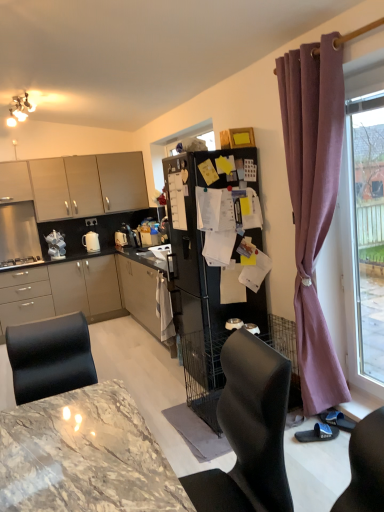
Question: Does matte white cabinet at upper left, the second cabinetry from the top, lie in front of white glossy electric kettle at center, which is the third appliance in left-to-right order?

Choices:
 (A) no
 (B) yes

Answer: (B)

Question: Can you confirm if matte white cabinet at upper left, the second cabinetry from the top, is wider than white glossy electric kettle at center, which is the third appliance in left-to-right order?

Choices:
 (A) yes
 (B) no

Answer: (A)

Question: Does matte white cabinet at upper left, acting as the 2th cabinetry starting from the bottom, have a greater height compared to white glossy electric kettle at center, which is the 1th appliance from right to left?

Choices:
 (A) no
 (B) yes

Answer: (B)

Question: Is matte white cabinet at upper left, acting as the 2th cabinetry starting from the bottom, not within white glossy electric kettle at center, which is the third appliance in left-to-right order?

Choices:
 (A) yes
 (B) no

Answer: (A)

Question: From a real-world perspective, does matte white cabinet at upper left, acting as the 2th cabinetry starting from the bottom, stand above white glossy electric kettle at center, which is the 1th appliance from right to left?

Choices:
 (A) no
 (B) yes

Answer: (B)

Question: Considering the relative sizes of matte white cabinet at upper left, acting as the 2th cabinetry starting from the bottom, and white glossy electric kettle at center, which is the third appliance in left-to-right order, in the image provided, is matte white cabinet at upper left, acting as the 2th cabinetry starting from the bottom, bigger than white glossy electric kettle at center, which is the third appliance in left-to-right order,?

Choices:
 (A) no
 (B) yes

Answer: (B)

Question: Is brushed metal oven at left, marked as the 3th appliance in a right-to-left arrangement, at the back of matte white cabinet at upper left, the second cabinetry from the top?

Choices:
 (A) yes
 (B) no

Answer: (B)

Question: Does matte white cabinet at upper left, the second cabinetry from the top, appear on the left side of brushed metal oven at left, marked as the 3th appliance in a right-to-left arrangement?

Choices:
 (A) no
 (B) yes

Answer: (B)

Question: Considering the relative positions of matte white cabinet at upper left, acting as the 2th cabinetry starting from the bottom, and brushed metal oven at left, the first appliance in the left-to-right sequence, in the image provided, is matte white cabinet at upper left, acting as the 2th cabinetry starting from the bottom, in front of brushed metal oven at left, the first appliance in the left-to-right sequence,?

Choices:
 (A) no
 (B) yes

Answer: (A)

Question: From a real-world perspective, is matte white cabinet at upper left, the second cabinetry from the top, physically above brushed metal oven at left, marked as the 3th appliance in a right-to-left arrangement?

Choices:
 (A) no
 (B) yes

Answer: (B)

Question: Is matte white cabinet at upper left, acting as the 2th cabinetry starting from the bottom, taller than brushed metal oven at left, marked as the 3th appliance in a right-to-left arrangement?

Choices:
 (A) yes
 (B) no

Answer: (A)

Question: Does matte white cabinet at upper left, acting as the 2th cabinetry starting from the bottom, turn towards brushed metal oven at left, the first appliance in the left-to-right sequence?

Choices:
 (A) no
 (B) yes

Answer: (A)

Question: Is there a large distance between white glossy kettle at left, which ranks as the 2th appliance in left-to-right order, and matte gray cabinets at left, the third cabinetry positioned from the top?

Choices:
 (A) yes
 (B) no

Answer: (B)